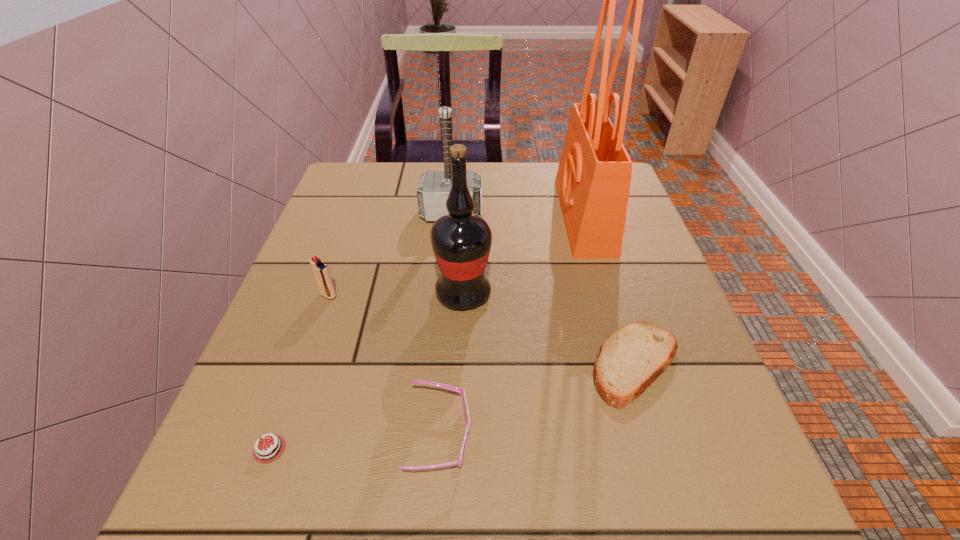
Find the location of a particular element. tote bag is located at coordinates (593, 180).

At what (x,y) coordinates should I click in order to perform the action: click on wine bottle. Please return your answer as a coordinate pair (x, y). The width and height of the screenshot is (960, 540). Looking at the image, I should click on coord(461,241).

The width and height of the screenshot is (960, 540). What are the coordinates of `the third tallest object` in the screenshot? It's located at (433, 188).

Where is `the fourth shortest object`? This screenshot has width=960, height=540. the fourth shortest object is located at coordinates (321, 272).

What are the coordinates of `sunglasses` in the screenshot? It's located at (466, 415).

Find the location of a particular element. Image resolution: width=960 pixels, height=540 pixels. pita bread is located at coordinates (631, 358).

Image resolution: width=960 pixels, height=540 pixels. Find the location of `chocolate cake`. chocolate cake is located at coordinates (269, 450).

The height and width of the screenshot is (540, 960). What are the coordinates of `vacant space located on the logo side of the tote bag` in the screenshot? It's located at (537, 216).

Locate an element on the screen. The image size is (960, 540). vacant space located 0.380m on the logo side of the tote bag is located at coordinates (406, 216).

This screenshot has width=960, height=540. I want to click on free point located 0.190m on the logo side of the tote bag, so click(x=484, y=216).